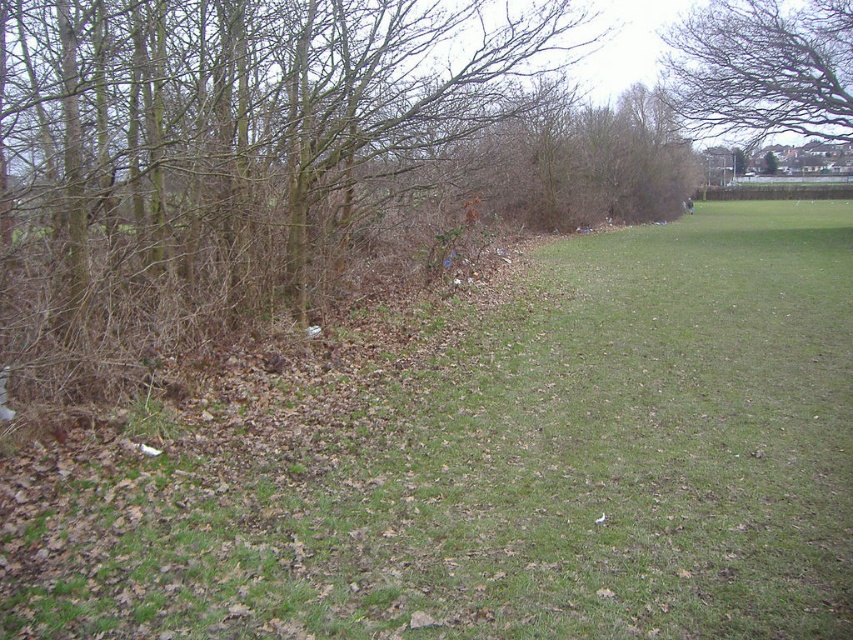
Question: Which point is farther to the camera?

Choices:
 (A) (750, 360)
 (B) (759, 4)

Answer: (B)

Question: Does green grassy at left appear under bare branches at upper center?

Choices:
 (A) no
 (B) yes

Answer: (B)

Question: Is green grassy at left to the left of bare branches at upper center from the viewer's perspective?

Choices:
 (A) yes
 (B) no

Answer: (A)

Question: Does green grassy at left have a greater width compared to bare branches at upper center?

Choices:
 (A) yes
 (B) no

Answer: (A)

Question: Which object appears closest to the camera in this image?

Choices:
 (A) green grassy at left
 (B) bare branches at upper center

Answer: (A)